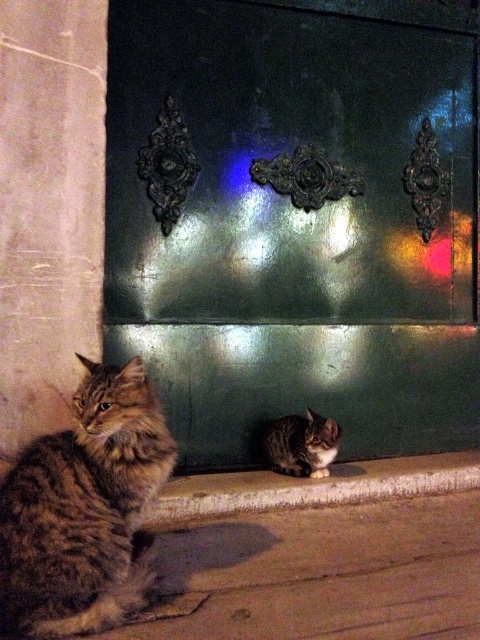
You are a small toy that is 10 cm tall. You are placed on the smooth concrete ledge at lower center. Can you see the top of the tabby fur cat at lower center from your position?

The smooth concrete ledge at lower center has a lesser height compared to tabby fur cat at lower center, so yes, the toy can see the top of the tabby fur cat at lower center because the ledge is shorter than the cat.

You are a cat owner who wants to ensure both cats have enough space to sit comfortably. Given that the larger tabby fur cat at left requires a minimum of 1.2 meters of space and the smaller tabby fur cat at lower center needs at least 0.8 meters, can they both fit in a 2.5 meter wide space?

The tabby fur cat at left is larger in size than the tabby fur cat at lower center. Since the total required space is 1.2 meters plus 0.8 meters equals 2.0 meters, which is less than the 2.5 meter space available, both cats can comfortably fit.